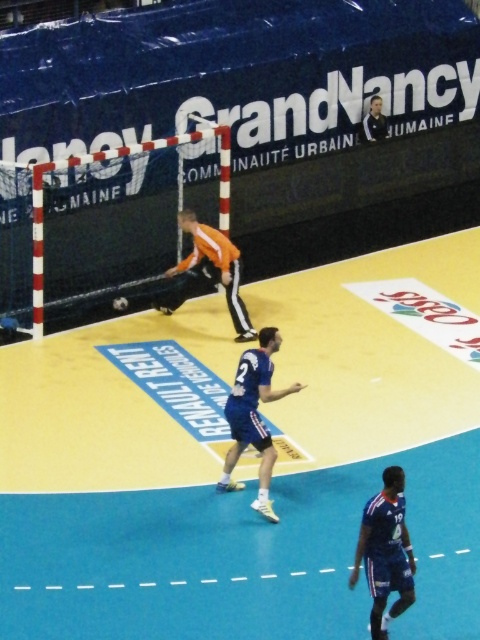
Who is shorter, blue fabric jersey at lower right or orange jersey at center?

With less height is blue fabric jersey at lower right.

Who is more forward, (x=410, y=582) or (x=216, y=246)?

Point (x=410, y=582) is more forward.

Between point (379, 637) and point (197, 252), which one is positioned behind?

Point (197, 252)

Where is `blue fabric jersey at lower right`? The image size is (480, 640). blue fabric jersey at lower right is located at coordinates (385, 550).

Does blue synthetic court at center have a lesser width compared to blue fabric jersey at lower right?

In fact, blue synthetic court at center might be wider than blue fabric jersey at lower right.

Which of these two, blue synthetic court at center or blue fabric jersey at lower right, stands shorter?

Standing shorter between the two is blue fabric jersey at lower right.

Is point (2, 608) positioned after point (382, 504)?

That is True.

Image resolution: width=480 pixels, height=640 pixels. In order to click on blue synthetic court at center in this screenshot , I will do `click(243, 461)`.

Is orange jersey at center wider than dark blue jersey at upper right?

Yes, orange jersey at center is wider than dark blue jersey at upper right.

Who is more forward, [197,227] or [376,138]?

Point [197,227] is in front.

You are a GUI agent. You are given a task and a screenshot of the screen. Output one action in this format:
    pyautogui.click(x=<x>, y=<y>)
    Task: Click on the orange jersey at center
    This screenshot has height=640, width=480.
    Given the screenshot: What is the action you would take?
    pyautogui.click(x=210, y=272)